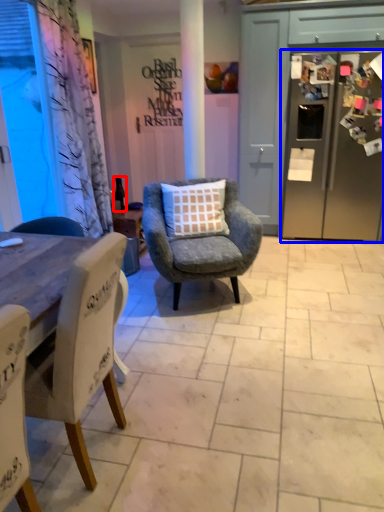
Question: Which object appears closest to the camera in this image, bottle (highlighted by a red box) or refrigerator (highlighted by a blue box)?

Choices:
 (A) bottle
 (B) refrigerator

Answer: (B)